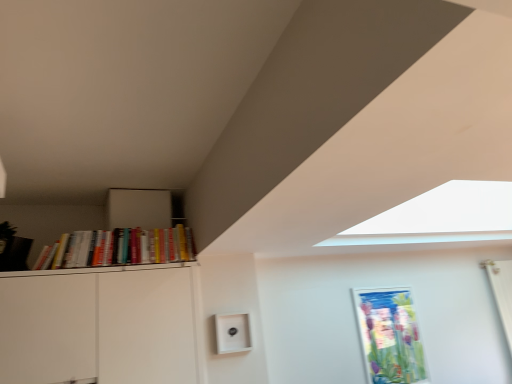
Question: Considering the relative positions of metallic silver picture frame at center-right and hardcover books at left in the image provided, is metallic silver picture frame at center-right to the right of hardcover books at left from the viewer's perspective?

Choices:
 (A) yes
 (B) no

Answer: (A)

Question: Would you say metallic silver picture frame at center-right is outside hardcover books at left?

Choices:
 (A) yes
 (B) no

Answer: (A)

Question: Are metallic silver picture frame at center-right and hardcover books at left far apart?

Choices:
 (A) yes
 (B) no

Answer: (A)

Question: Does metallic silver picture frame at center-right turn towards hardcover books at left?

Choices:
 (A) no
 (B) yes

Answer: (A)

Question: Does metallic silver picture frame at center-right touch hardcover books at left?

Choices:
 (A) yes
 (B) no

Answer: (B)

Question: Is metallic silver picture frame at center-right smaller than hardcover books at left?

Choices:
 (A) no
 (B) yes

Answer: (B)

Question: Is hardcover books at left aimed at metallic silver picture frame at center-right?

Choices:
 (A) no
 (B) yes

Answer: (A)

Question: From a real-world perspective, is hardcover books at left below metallic silver picture frame at center-right?

Choices:
 (A) no
 (B) yes

Answer: (A)

Question: Are hardcover books at left and metallic silver picture frame at center-right far apart?

Choices:
 (A) yes
 (B) no

Answer: (A)

Question: Does hardcover books at left have a smaller size compared to metallic silver picture frame at center-right?

Choices:
 (A) no
 (B) yes

Answer: (A)

Question: From the image's perspective, would you say hardcover books at left is positioned over metallic silver picture frame at center-right?

Choices:
 (A) yes
 (B) no

Answer: (A)

Question: Is hardcover books at left next to metallic silver picture frame at center-right and touching it?

Choices:
 (A) yes
 (B) no

Answer: (B)

Question: Do you think metallic silver picture frame at center-right is within hardcover books at left, or outside of it?

Choices:
 (A) outside
 (B) inside

Answer: (A)